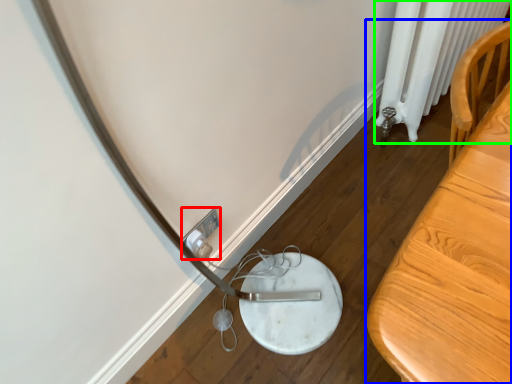
Question: Which is farther away from electric outlet (highlighted by a red box)? furniture (highlighted by a blue box) or radiator (highlighted by a green box)?

Choices:
 (A) furniture
 (B) radiator

Answer: (B)